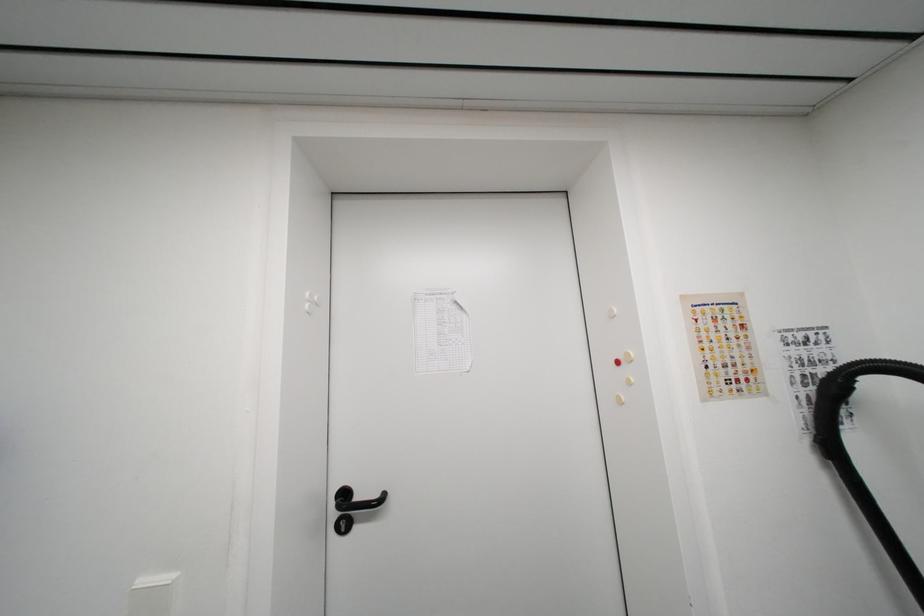
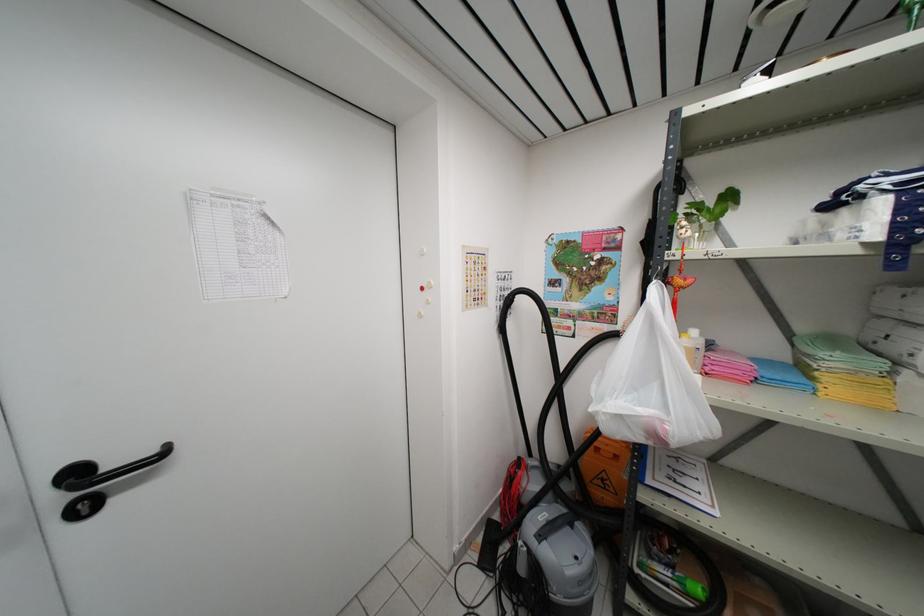
Where in the second image is the point corresponding to (345,528) from the first image?

(83, 512)